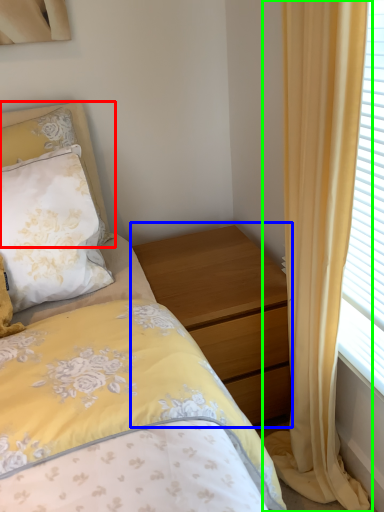
Question: Which object is the farthest from pillow (highlighted by a red box)? Choose among these: nightstand (highlighted by a blue box) or curtain (highlighted by a green box).

Choices:
 (A) nightstand
 (B) curtain

Answer: (B)